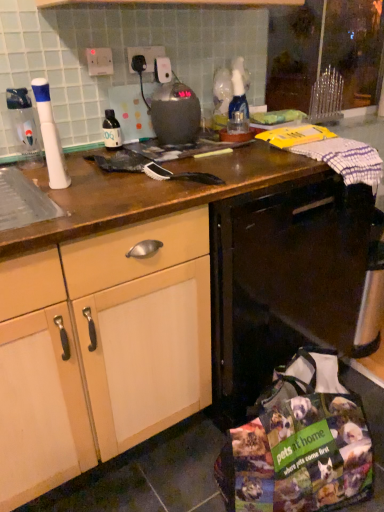
Question: Does matte black bottle at center, acting as the 1th bottle starting from the right, have a larger size compared to white plastic electric outlet at upper center, the 2th electric outlet in the right-to-left sequence?

Choices:
 (A) no
 (B) yes

Answer: (B)

Question: Is matte black bottle at center, arranged as the 1th bottle when viewed from the back, turned away from white plastic electric outlet at upper center, the 2th electric outlet in the right-to-left sequence?

Choices:
 (A) yes
 (B) no

Answer: (B)

Question: Is matte black bottle at center, arranged as the 1th bottle when viewed from the back, further to the viewer compared to white plastic electric outlet at upper center, the 2th electric outlet in the right-to-left sequence?

Choices:
 (A) yes
 (B) no

Answer: (A)

Question: Would you say white plastic electric outlet at upper center, the first electric outlet from the left, is part of matte black bottle at center, acting as the 1th bottle starting from the right,'s contents?

Choices:
 (A) no
 (B) yes

Answer: (A)

Question: Considering the relative sizes of matte black bottle at center, acting as the 1th bottle starting from the right, and white plastic electric outlet at upper center, the first electric outlet from the left, in the image provided, is matte black bottle at center, acting as the 1th bottle starting from the right, wider than white plastic electric outlet at upper center, the first electric outlet from the left,?

Choices:
 (A) yes
 (B) no

Answer: (A)

Question: Is matte black bottle at center, arranged as the 1th bottle when viewed from the back, smaller than white plastic electric outlet at upper center, the first electric outlet from the left?

Choices:
 (A) no
 (B) yes

Answer: (A)

Question: From a real-world perspective, is white plastic electric outlet at upper center, the first electric outlet from the left, located higher than metallic gray kettle at center?

Choices:
 (A) no
 (B) yes

Answer: (B)

Question: Is white plastic electric outlet at upper center, the 2th electric outlet in the right-to-left sequence, positioned beyond the bounds of metallic gray kettle at center?

Choices:
 (A) no
 (B) yes

Answer: (B)

Question: Considering the relative sizes of white plastic electric outlet at upper center, the first electric outlet from the left, and metallic gray kettle at center in the image provided, is white plastic electric outlet at upper center, the first electric outlet from the left, shorter than metallic gray kettle at center?

Choices:
 (A) yes
 (B) no

Answer: (A)

Question: From the image's perspective, is white plastic electric outlet at upper center, the first electric outlet from the left, under metallic gray kettle at center?

Choices:
 (A) yes
 (B) no

Answer: (B)

Question: Considering the relative positions of white plastic electric outlet at upper center, the 2th electric outlet in the right-to-left sequence, and metallic gray kettle at center in the image provided, is white plastic electric outlet at upper center, the 2th electric outlet in the right-to-left sequence, to the right of metallic gray kettle at center from the viewer's perspective?

Choices:
 (A) yes
 (B) no

Answer: (B)

Question: From the image's perspective, is white plastic electric outlet at upper center, the first electric outlet from the left, on top of metallic gray kettle at center?

Choices:
 (A) yes
 (B) no

Answer: (A)

Question: Can you confirm if white plastic toothbrush at left is smaller than metallic gray kettle at center?

Choices:
 (A) yes
 (B) no

Answer: (A)